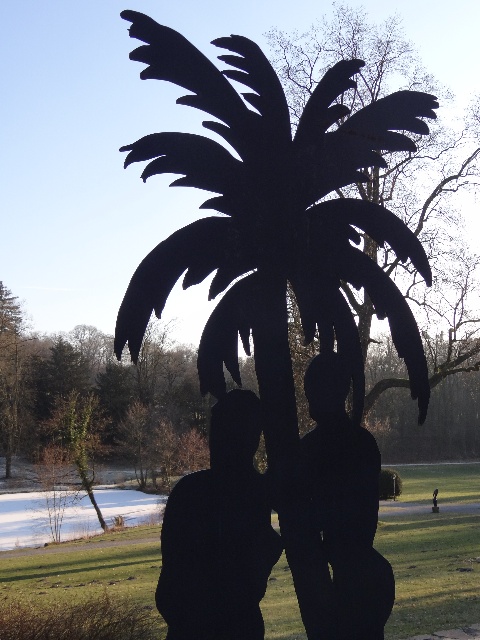
You are standing in a park and see the black matte couple at center and the black matte statue at center. Which one is closer to you?

The black matte couple at center is closer to you because they are in front of the black matte statue at center.

You are standing at point (280, 525) in the image. What object is located at this point?

The black matte couple at center is located at point (280, 525).

You are standing in the park and see the black matte palm tree at center and the black matte man at center. Which object is positioned higher in the image?

The black matte palm tree at center is located above the black matte man at center, so it is positioned higher in the image.